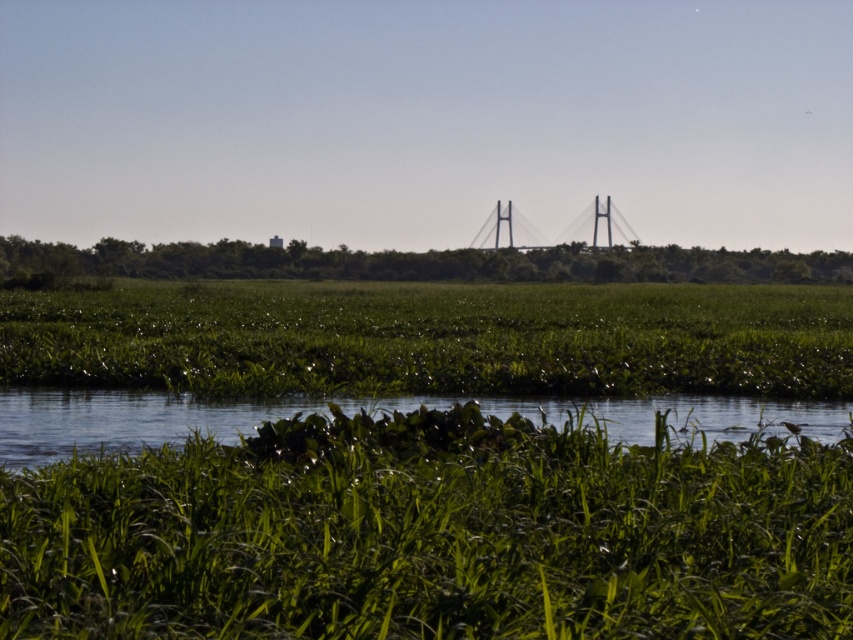
Between point (421, 336) and point (570, 236), which one is positioned behind?

The point (570, 236) is more distant.

Which is more to the right, green leafy grass at center or metallic gray suspension bridge at center?

From the viewer's perspective, metallic gray suspension bridge at center appears more on the right side.

Identify the location of green leafy grass at center. (432, 339).

Describe the element at coordinates (432, 534) in the screenshot. I see `green leafy grass at lower center` at that location.

Does point (625, 554) come farther from viewer compared to point (636, 400)?

No.

Image resolution: width=853 pixels, height=640 pixels. I want to click on green leafy grass at lower center, so click(x=432, y=534).

Is green leafy grass at lower center above metallic gray suspension bridge at center?

Incorrect, green leafy grass at lower center is not positioned above metallic gray suspension bridge at center.

Where is `green leafy grass at lower center`? The height and width of the screenshot is (640, 853). green leafy grass at lower center is located at coordinates (432, 534).